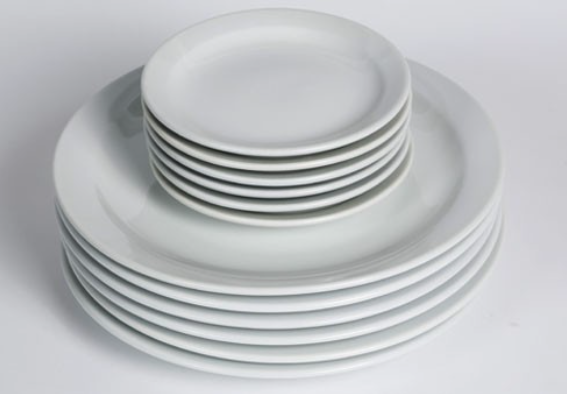
I want to click on small plates, so click(x=290, y=150), click(x=290, y=165), click(x=290, y=180), click(x=293, y=193), click(x=296, y=204), click(x=298, y=217).